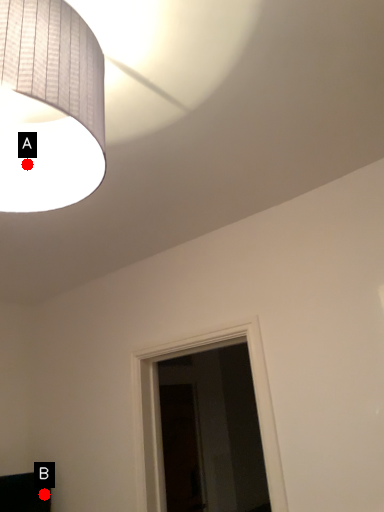
Question: Two points are circled on the image, labeled by A and B beside each circle. Which point is closer to the camera taking this photo?

Choices:
 (A) A is closer
 (B) B is closer

Answer: (A)